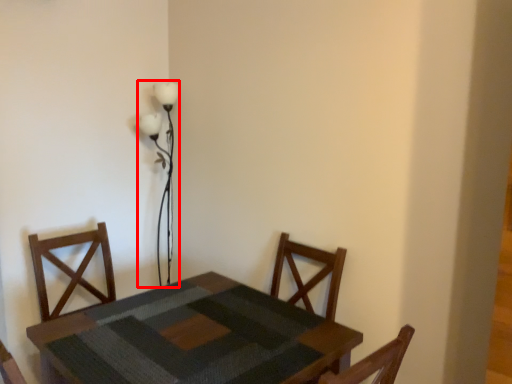
Question: From the image's perspective, what is the correct spatial positioning of table lamp (annotated by the red box) in reference to table?

Choices:
 (A) below
 (B) above

Answer: (B)